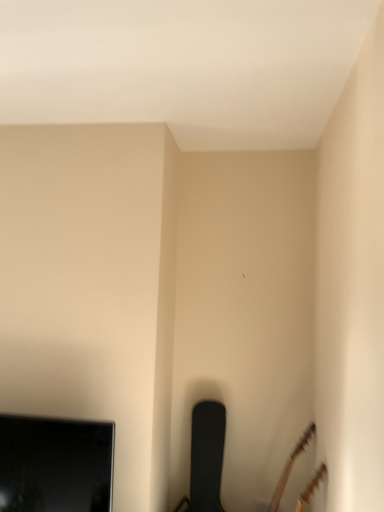
Question: Considering the relative sizes of black textured chair at lower center and black glossy television at lower left in the image provided, is black textured chair at lower center thinner than black glossy television at lower left?

Choices:
 (A) yes
 (B) no

Answer: (B)

Question: From a real-world perspective, is black textured chair at lower center located beneath black glossy television at lower left?

Choices:
 (A) no
 (B) yes

Answer: (B)

Question: Does black textured chair at lower center turn towards black glossy television at lower left?

Choices:
 (A) no
 (B) yes

Answer: (A)

Question: From the image's perspective, is black textured chair at lower center beneath black glossy television at lower left?

Choices:
 (A) no
 (B) yes

Answer: (B)

Question: Is black textured chair at lower center not near black glossy television at lower left?

Choices:
 (A) no
 (B) yes

Answer: (A)

Question: Is the surface of black textured chair at lower center in direct contact with black glossy television at lower left?

Choices:
 (A) no
 (B) yes

Answer: (A)

Question: Is black glossy television at lower left next to brown matte guitar at lower right?

Choices:
 (A) no
 (B) yes

Answer: (A)

Question: Is black glossy television at lower left taller than brown matte guitar at lower right?

Choices:
 (A) yes
 (B) no

Answer: (B)

Question: Can you confirm if black glossy television at lower left is smaller than brown matte guitar at lower right?

Choices:
 (A) yes
 (B) no

Answer: (A)

Question: Considering the relative sizes of black glossy television at lower left and brown matte guitar at lower right in the image provided, is black glossy television at lower left thinner than brown matte guitar at lower right?

Choices:
 (A) yes
 (B) no

Answer: (A)

Question: Does black glossy television at lower left turn towards brown matte guitar at lower right?

Choices:
 (A) no
 (B) yes

Answer: (A)

Question: From a real-world perspective, is black glossy television at lower left located beneath brown matte guitar at lower right?

Choices:
 (A) yes
 (B) no

Answer: (B)

Question: Is brown matte guitar at lower right far away from black textured chair at lower center?

Choices:
 (A) yes
 (B) no

Answer: (B)